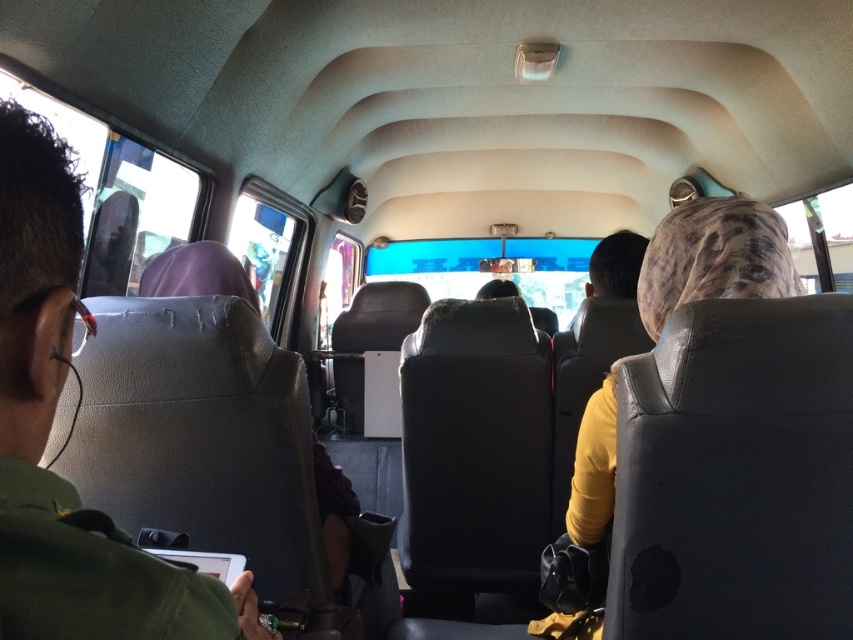
You are a passenger seated at the front of the bus and want to reach both the point at coordinates point (136, 602) and the point at coordinates point (149, 272). Which point is closer to your current position?

Point (136, 602) is closer to the viewer than point (149, 272), so the point at coordinates point (136, 602) is closer to your current position.